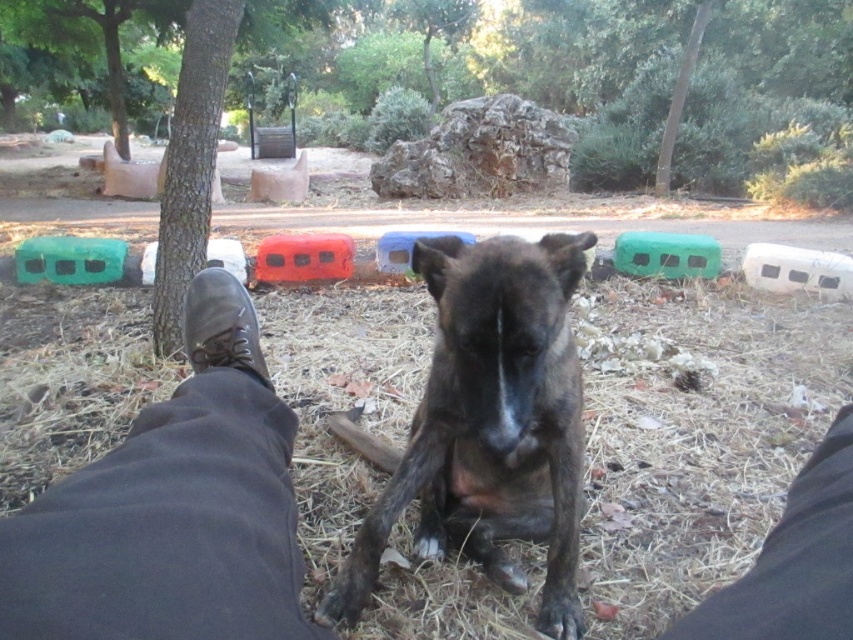
How far apart are brown fur dog at center and leather boot at lower left?

brown fur dog at center and leather boot at lower left are 42.81 centimeters apart from each other.

Does brown fur dog at center have a greater height compared to leather boot at lower left?

Indeed, brown fur dog at center has a greater height compared to leather boot at lower left.

This screenshot has width=853, height=640. What do you see at coordinates (488, 424) in the screenshot?
I see `brown fur dog at center` at bounding box center [488, 424].

This screenshot has width=853, height=640. What are the coordinates of `brown fur dog at center` in the screenshot? It's located at (488, 424).

Does brown rough bark tree at left have a larger size compared to leather boot at lower left?

Yes.

Does brown rough bark tree at left have a lesser height compared to leather boot at lower left?

Incorrect, brown rough bark tree at left's height does not fall short of leather boot at lower left's.

This screenshot has height=640, width=853. I want to click on brown rough bark tree at left, so click(x=190, y=161).

At what (x,y) coordinates should I click in order to perform the action: click on brown rough bark tree at left. Please return your answer as a coordinate pair (x, y). This screenshot has width=853, height=640. Looking at the image, I should click on (190, 161).

Which is more to the right, brown dry hay at lower center or leather shoe at lower left?

brown dry hay at lower center

Does brown dry hay at lower center appear on the right side of leather shoe at lower left?

Correct, you'll find brown dry hay at lower center to the right of leather shoe at lower left.

Identify the location of brown dry hay at lower center. (167, 529).